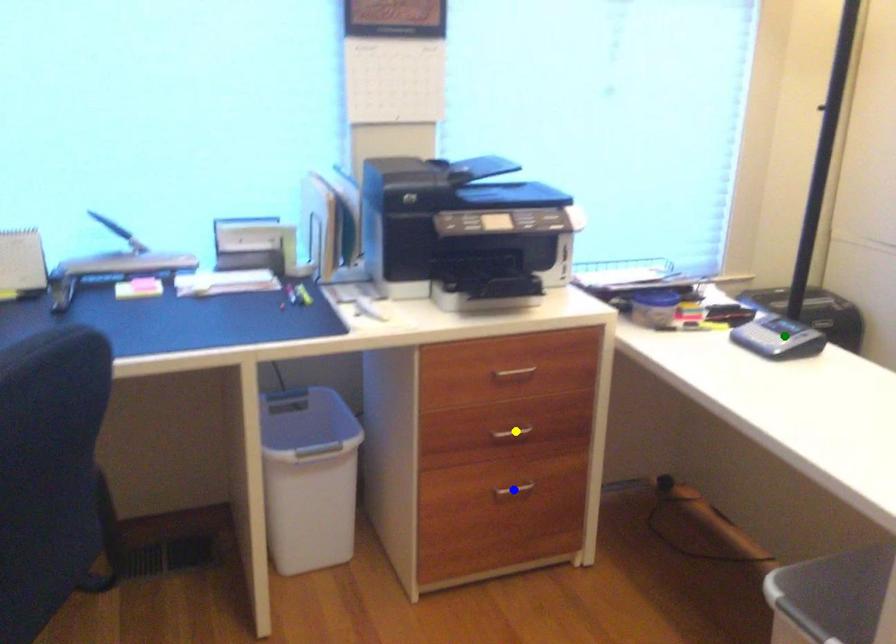
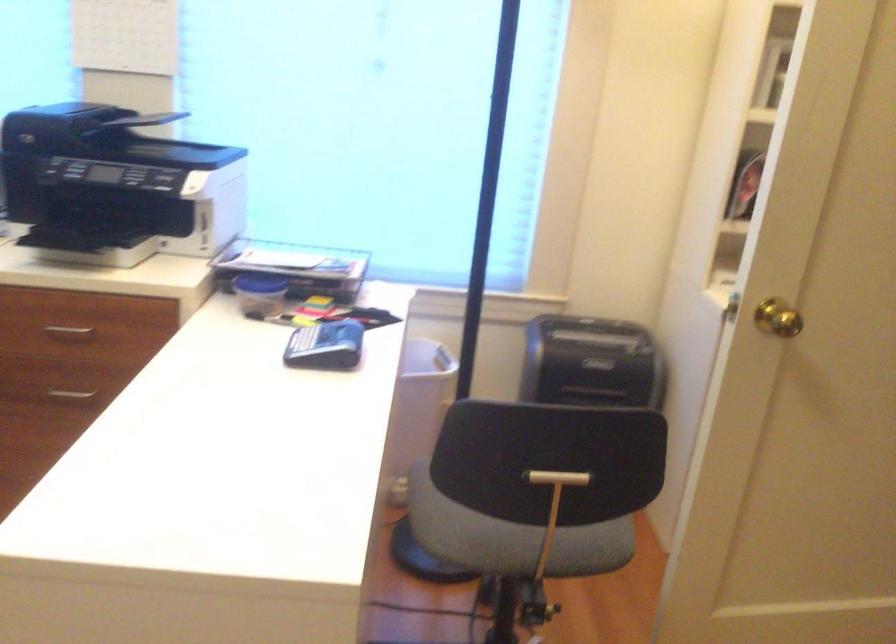
I am providing you with two images of the same scene from different viewpoints. Three points are marked in image1. Which point corresponds to a part or object that is occluded in image2?In image1, three points are marked. Which of them correspond to a part or object that is occluded in image2?Among the three points shown in image1, which one corresponds to a part or object that is no longer visible due to occlusion in image2?

Invisible in image2: blue point.